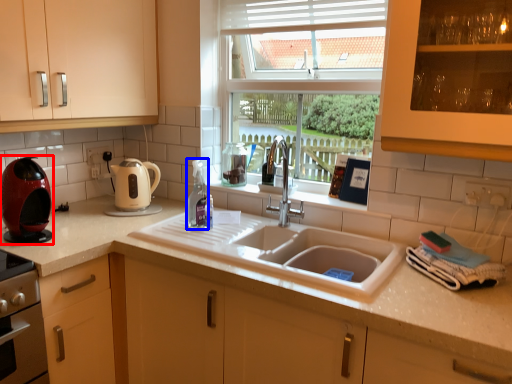
Question: Among these objects, which one is nearest to the camera, kitchen appliance (highlighted by a red box) or bottle (highlighted by a blue box)?

Choices:
 (A) kitchen appliance
 (B) bottle

Answer: (A)